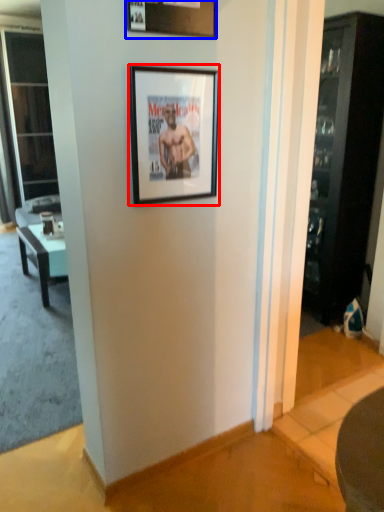
Question: Which point is further to the camera, picture frame (highlighted by a red box) or picture frame (highlighted by a blue box)?

Choices:
 (A) picture frame
 (B) picture frame

Answer: (A)